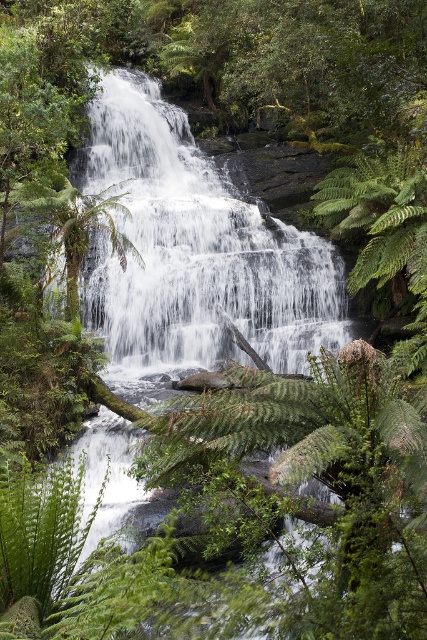
Does white frothy water at center appear on the left side of green leafy fern at lower left?

Yes, white frothy water at center is to the left of green leafy fern at lower left.

Between white frothy water at center and green leafy fern at lower left, which one appears on the right side from the viewer's perspective?

green leafy fern at lower left

Is point (98, 323) closer to camera compared to point (53, 499)?

No.

This screenshot has width=427, height=640. Find the location of `white frothy water at center`. white frothy water at center is located at coordinates (193, 252).